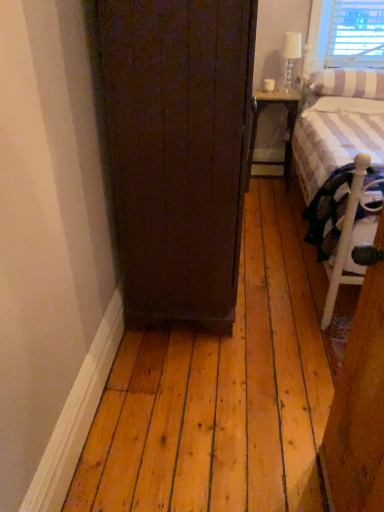
Identify the location of white glass lamp at upper right. point(290,55).

At what (x,y) coordinates should I click in order to perform the action: click on white striped fabric at right. Please return your answer as a coordinate pair (x, y). Looking at the image, I should click on (341, 169).

Considering the relative sizes of white striped fabric at right and white glass lamp at upper right in the image provided, is white striped fabric at right smaller than white glass lamp at upper right?

No.

Considering the relative sizes of white striped fabric at right and white glass lamp at upper right in the image provided, is white striped fabric at right shorter than white glass lamp at upper right?

No.

How far apart are white striped fabric at right and white glass lamp at upper right?

white striped fabric at right and white glass lamp at upper right are 37.72 inches apart.

Is white striped fabric at right looking in the opposite direction of white glass lamp at upper right?

No, white striped fabric at right is not facing away from white glass lamp at upper right.

In terms of height, does white striped fabric at right look taller or shorter compared to dark wood door at center?

Clearly, white striped fabric at right is shorter compared to dark wood door at center.

From a real-world perspective, is white striped fabric at right physically below dark wood door at center?

Yes, from a real-world perspective, white striped fabric at right is below dark wood door at center.

Considering their positions, is white striped fabric at right located in front of or behind dark wood door at center?

white striped fabric at right is positioned farther from the viewer than dark wood door at center.

From the image's perspective, is metallic gray nightstand at right above dark wood door at center?

Yes, from the image's perspective, metallic gray nightstand at right is above dark wood door at center.

Is metallic gray nightstand at right far from dark wood door at center?

Yes, metallic gray nightstand at right and dark wood door at center are located far from each other.

Can dark wood door at center be found inside metallic gray nightstand at right?

That's incorrect, dark wood door at center is not inside metallic gray nightstand at right.

Measure the distance between metallic gray nightstand at right and dark wood door at center.

A distance of 5.93 feet exists between metallic gray nightstand at right and dark wood door at center.

Is white glass lamp at upper right at the right side of metallic gray nightstand at right?

Yes, white glass lamp at upper right is to the right of metallic gray nightstand at right.

From a real-world perspective, between white glass lamp at upper right and metallic gray nightstand at right, who is vertically higher?

white glass lamp at upper right, from a real-world perspective.

Can you see white glass lamp at upper right touching metallic gray nightstand at right?

white glass lamp at upper right and metallic gray nightstand at right are clearly separated.

Is white glass lamp at upper right inside or outside of metallic gray nightstand at right?

white glass lamp at upper right is spatially situated outside metallic gray nightstand at right.

Considering their positions, is white glass lamp at upper right located in front of or behind striped fabric pillow at upper right?

Clearly, white glass lamp at upper right is behind striped fabric pillow at upper right.

Is white glass lamp at upper right not near striped fabric pillow at upper right?

No, white glass lamp at upper right is not far away from striped fabric pillow at upper right.

Can you confirm if white glass lamp at upper right is positioned to the right of striped fabric pillow at upper right?

No, white glass lamp at upper right is not to the right of striped fabric pillow at upper right.

Is point (144, 320) closer to camera compared to point (352, 268)?

No.

Is dark wood door at center wider or thinner than white striped fabric at right?

Considering their sizes, dark wood door at center looks slimmer than white striped fabric at right.

From a real-world perspective, between dark wood door at center and white striped fabric at right, who is vertically lower?

From a 3D spatial view, white striped fabric at right is below.

Is the surface of dark wood door at center in direct contact with white striped fabric at right?

No.

Is white glass lamp at upper right to the right of dark wood door at center from the viewer's perspective?

Yes, white glass lamp at upper right is to the right of dark wood door at center.

Is white glass lamp at upper right positioned far away from dark wood door at center?

white glass lamp at upper right is positioned a significant distance from dark wood door at center.

Is dark wood door at center at the back of white glass lamp at upper right?

No, dark wood door at center is not at the back of white glass lamp at upper right.

Who is more distant, white glass lamp at upper right or dark wood door at center?

white glass lamp at upper right is behind.

Where is `lamp behind the white striped fabric at right`? This screenshot has height=512, width=384. lamp behind the white striped fabric at right is located at coordinates (290, 55).

In the image, there is a white striped fabric at right. Where is `door below it (from the image's perspective)`? The width and height of the screenshot is (384, 512). door below it (from the image's perspective) is located at coordinates (178, 152).

When comparing their distances from white striped fabric at right, does metallic gray nightstand at right or white glass lamp at upper right seem further?

Among the two, white glass lamp at upper right is located further to white striped fabric at right.

When comparing their distances from metallic gray nightstand at right, does dark wood door at center or white glass lamp at upper right seem closer?

Among the two, white glass lamp at upper right is located nearer to metallic gray nightstand at right.

From the image, which object appears to be farther from dark wood door at center, metallic gray nightstand at right or white striped fabric at right?

Among the two, metallic gray nightstand at right is located further to dark wood door at center.

Considering their positions, is dark wood door at center positioned closer to white striped fabric at right than metallic gray nightstand at right?

The object closer to white striped fabric at right is metallic gray nightstand at right.

Based on their spatial positions, is dark wood door at center or white striped fabric at right closer to striped fabric pillow at upper right?

The object closer to striped fabric pillow at upper right is white striped fabric at right.

Which object lies nearer to the anchor point white glass lamp at upper right, white striped fabric at right or dark wood door at center?

white striped fabric at right is positioned closer to the anchor white glass lamp at upper right.

Based on their spatial positions, is striped fabric pillow at upper right or white striped fabric at right closer to metallic gray nightstand at right?

Based on the image, striped fabric pillow at upper right appears to be nearer to metallic gray nightstand at right.

Consider the image. When comparing their distances from dark wood door at center, does striped fabric pillow at upper right or metallic gray nightstand at right seem closer?

Based on the image, striped fabric pillow at upper right appears to be nearer to dark wood door at center.

Locate an element on the screen. The width and height of the screenshot is (384, 512). bed between dark wood door at center and metallic gray nightstand at right in the front-back direction is located at coordinates (341, 169).

You are a GUI agent. You are given a task and a screenshot of the screen. Output one action in this format:
    pyautogui.click(x=<x>, y=<y>)
    Task: Click on the bed positioned between dark wood door at center and striped fabric pillow at upper right from near to far
    
    Given the screenshot: What is the action you would take?
    pyautogui.click(x=341, y=169)

At what (x,y) coordinates should I click in order to perform the action: click on lamp located between metallic gray nightstand at right and striped fabric pillow at upper right in the left-right direction. Please return your answer as a coordinate pair (x, y). The height and width of the screenshot is (512, 384). Looking at the image, I should click on (290, 55).

I want to click on pillow between dark wood door at center and white glass lamp at upper right from front to back, so click(x=347, y=83).